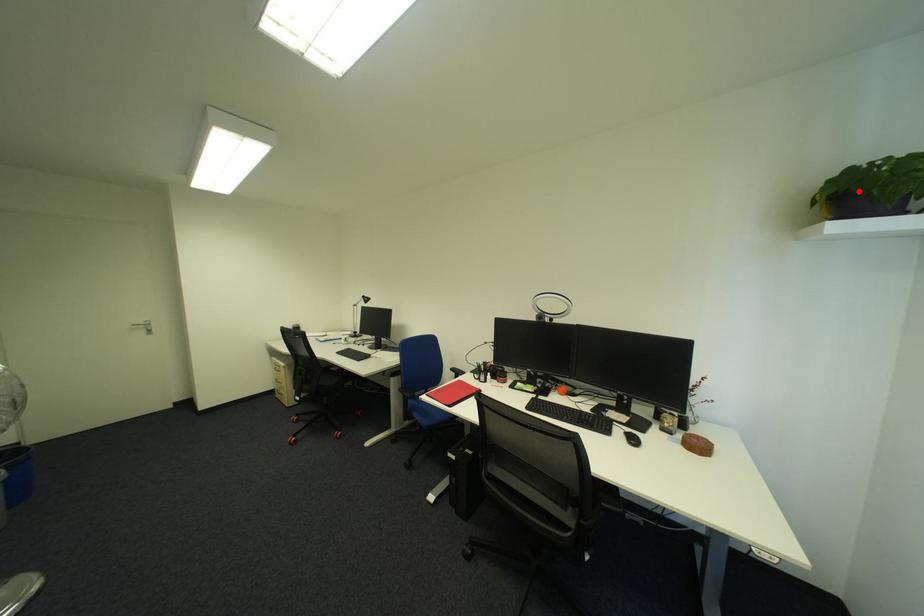
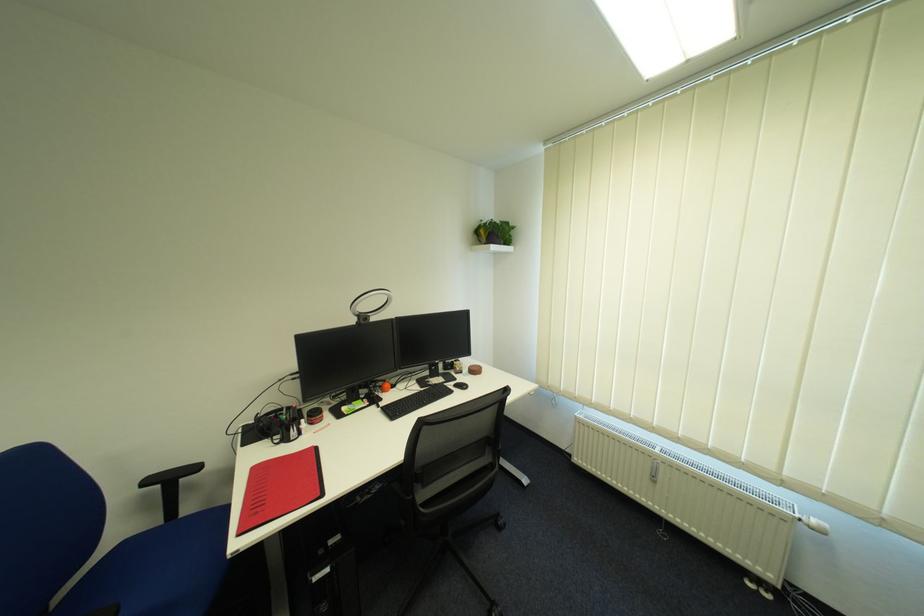
Question: I am providing you with two images of the same scene from different viewpoints. Image1 has a red point marked. In image2, the corresponding 3D location appears at what relative position? Reply with the corresponding letter.

Choices:
 (A) Closer
 (B) Farther

Answer: (A)